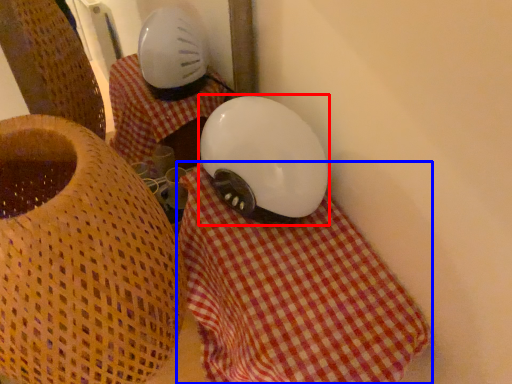
Question: Which point is closer to the camera, helmet (highlighted by a red box) or blanket (highlighted by a blue box)?

Choices:
 (A) helmet
 (B) blanket

Answer: (B)